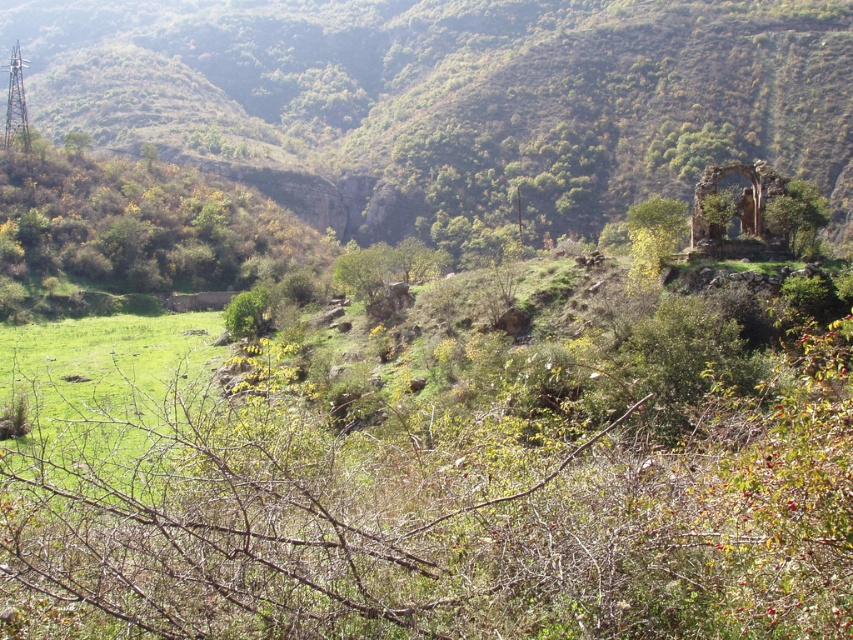
Question: Is green leafy shrub at left thinner than green leafy tree at upper right?

Choices:
 (A) yes
 (B) no

Answer: (B)

Question: Which point is closer to the camera?

Choices:
 (A) green grassy hillside at center
 (B) green leafy shrub at left
 (C) green leafy tree at upper right
 (D) green leafy tree at center-right

Answer: (C)

Question: Which point is closer to the camera taking this photo?

Choices:
 (A) (84, 170)
 (B) (711, 212)

Answer: (B)

Question: Is green grassy hillside at center thinner than green leafy shrub at left?

Choices:
 (A) yes
 (B) no

Answer: (B)

Question: Which point appears farthest from the camera in this image?

Choices:
 (A) (793, 220)
 (B) (720, 205)
 (C) (265, 202)

Answer: (C)

Question: Can you confirm if green leafy shrub at left is bigger than green leafy tree at center-right?

Choices:
 (A) yes
 (B) no

Answer: (A)